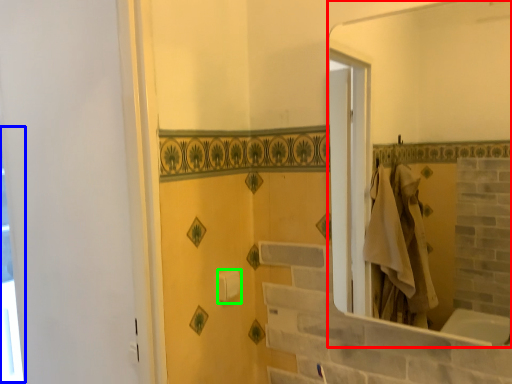
Question: Which object is positioned farthest from mirror (highlighted by a red box)? Select from window (highlighted by a blue box) and towel bar (highlighted by a green box).

Choices:
 (A) window
 (B) towel bar

Answer: (A)